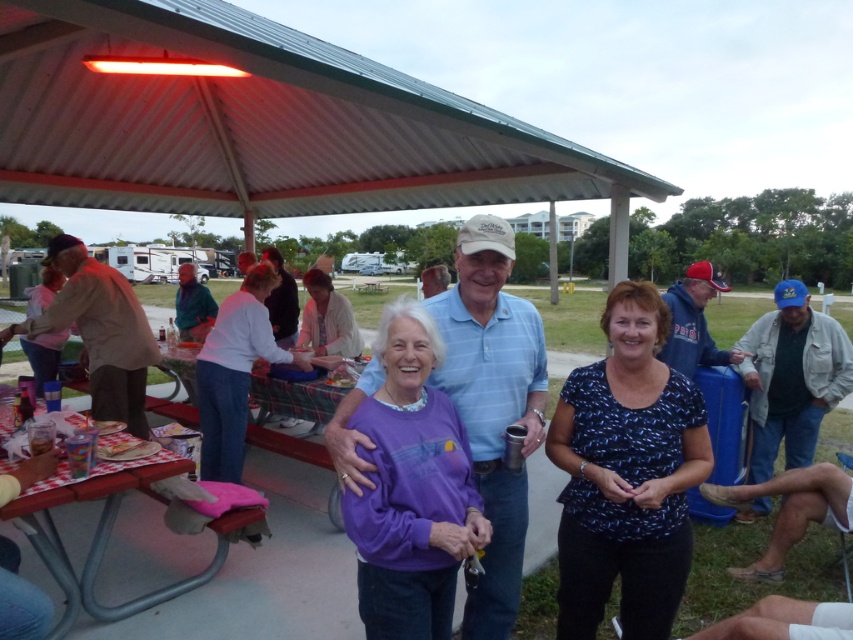
Question: Is light brown cotton shirt at left positioned in front of red plastic table at lower left?

Choices:
 (A) yes
 (B) no

Answer: (B)

Question: Which object appears farthest from the camera in this image?

Choices:
 (A) purple fleece at center
 (B) red plastic table at lower left

Answer: (B)

Question: Can you confirm if purple fleece at center is thinner than red plastic table at lower left?

Choices:
 (A) no
 (B) yes

Answer: (B)

Question: Can you confirm if blue denim jacket at lower right is positioned to the left of red plastic table at lower left?

Choices:
 (A) yes
 (B) no

Answer: (B)

Question: Among these points, which one is farthest from the camera?

Choices:
 (A) (26, 332)
 (B) (569, 634)
 (C) (32, 538)

Answer: (A)

Question: Which object is positioned closest to the blue denim jacket at lower right?

Choices:
 (A) light brown cotton shirt at left
 (B) red plastic table at lower left

Answer: (B)